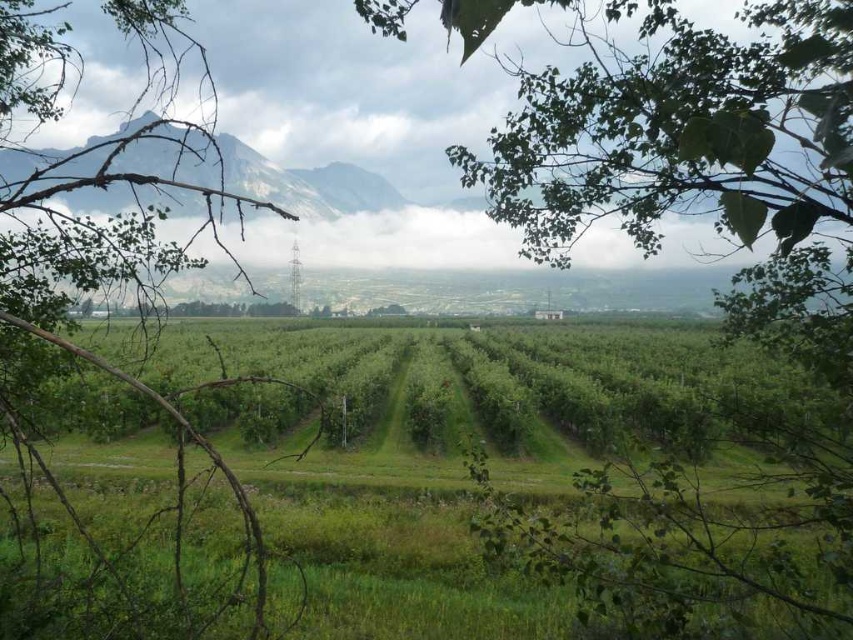
You are standing in the orchard and see two points marked in the image. The first point is at coordinate point (578, 106) and the second is at point (61, 291). Which point is nearer to you?

Point (578, 106) is closer to the camera than point (61, 291), so the first point is nearer to you.

From the picture: You are a hiker standing at the base of the gray rocky mountain at upper center and want to reach the green leafy tree at center. Which direction should you head to get closer to the tree?

The gray rocky mountain at upper center is taller than the green leafy tree at center, so you should head downward towards the green leafy tree at center.

In the orchard scene, there is a green leafy branch at left and a point marked at coordinates (103, 285). What does this point represent?

The point (103, 285) represents the green leafy branch at left.